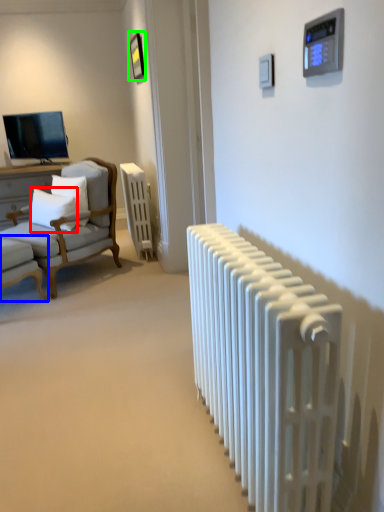
Question: Estimate the real-world distances between objects in this image. Which object is closer to pillow (highlighted by a red box), chair (highlighted by a blue box) or picture frame (highlighted by a green box)?

Choices:
 (A) chair
 (B) picture frame

Answer: (A)